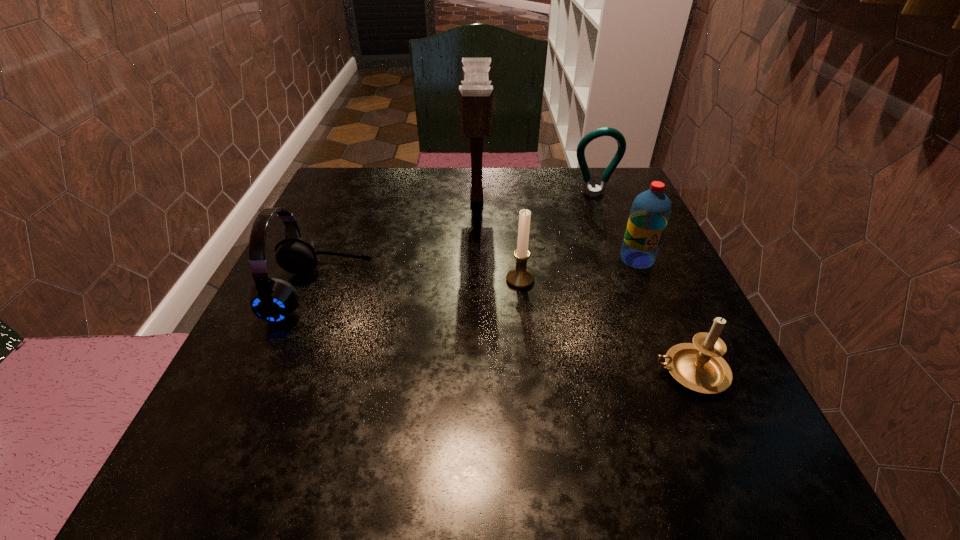
Where is `bottle opener that is at the right edge`? bottle opener that is at the right edge is located at coordinates (605, 131).

At what (x,y) coordinates should I click in order to perform the action: click on water bottle present at the right edge. Please return your answer as a coordinate pair (x, y). Image resolution: width=960 pixels, height=540 pixels. Looking at the image, I should click on (650, 211).

The height and width of the screenshot is (540, 960). Find the location of `candle holder present at the right edge`. candle holder present at the right edge is located at coordinates (698, 366).

You are a GUI agent. You are given a task and a screenshot of the screen. Output one action in this format:
    pyautogui.click(x=<x>, y=<y>)
    Task: Click on the object that is at the far right corner
    Image resolution: width=960 pixels, height=540 pixels.
    Given the screenshot: What is the action you would take?
    pyautogui.click(x=605, y=131)

This screenshot has height=540, width=960. I want to click on free point at the far edge, so click(507, 182).

Image resolution: width=960 pixels, height=540 pixels. Find the location of `vacant space at the left edge of the desktop`. vacant space at the left edge of the desktop is located at coordinates (x=304, y=233).

The image size is (960, 540). In the image, there is a desktop. What are the coordinates of `free space at the right edge` in the screenshot? It's located at (608, 226).

The image size is (960, 540). I want to click on vacant area at the far left corner, so click(x=348, y=169).

This screenshot has height=540, width=960. In the image, there is a desktop. What are the coordinates of `vacant space at the near left corner` in the screenshot? It's located at (196, 493).

In the image, there is a desktop. Where is `vacant space at the far right corner`? vacant space at the far right corner is located at coordinates (603, 174).